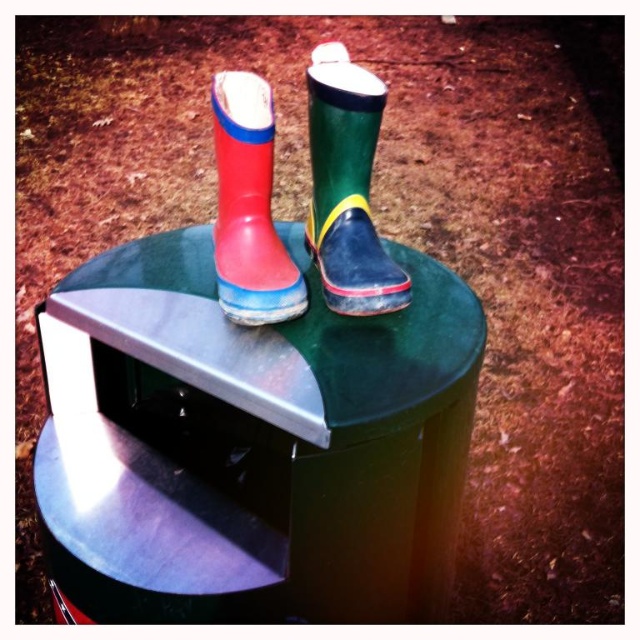
You are trying to determine if the green rubber boot at upper center can fit on the green rubber stool at center. Based on their widths, will it fit?

The green rubber stool at center is wider than the green rubber boot at upper center, so the boot should fit comfortably on the stool.